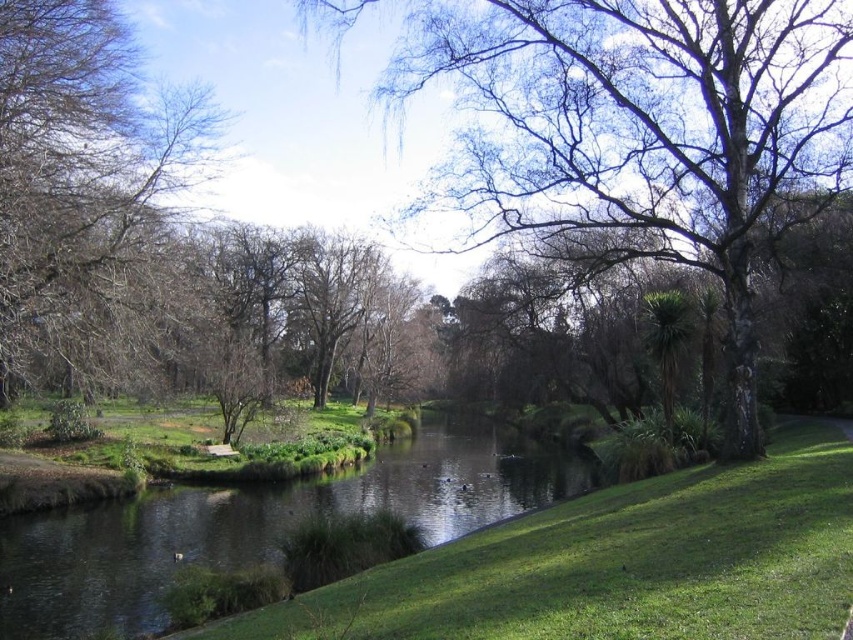
You are standing on the bank of the green grassy river at center and want to cross to the other side. There is a brown leafy tree at left nearby. Can you use the tree to help you cross the river?

The green grassy river at center might be wider than the brown leafy tree at left, so the tree may not be long enough to help you cross the river.

You are standing at the center of the image and want to reach the riverbank. The bare branches at center are in your way. Which direction should you move to avoid them?

Result: Since the bare branches at center are located at point (639, 132), you should move towards the lower right direction to avoid them and reach the riverbank.

You are an observer standing in the middle of the riverbank. You see the bare branches at center and the brown leafy tree at left. Which object is located to the right of the other?

The bare branches at center is positioned on the right side of brown leafy tree at left, so the bare branches at center is to the right of the brown leafy tree at left.